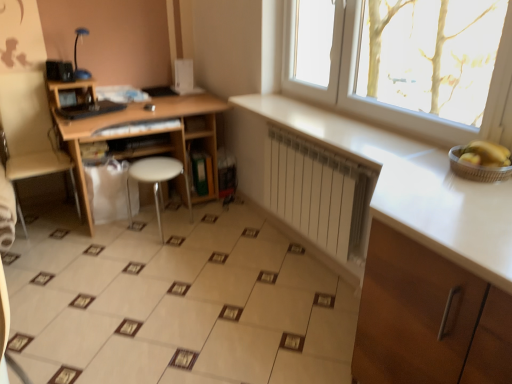
Question: From a real-world perspective, is white matte radiator at center under beige ceramic tile at center?

Choices:
 (A) no
 (B) yes

Answer: (A)

Question: Is white matte radiator at center directly adjacent to beige ceramic tile at center?

Choices:
 (A) yes
 (B) no

Answer: (B)

Question: Is the depth of white matte radiator at center greater than that of beige ceramic tile at center?

Choices:
 (A) no
 (B) yes

Answer: (B)

Question: Is white matte radiator at center wider than beige ceramic tile at center?

Choices:
 (A) yes
 (B) no

Answer: (B)

Question: From the image's perspective, would you say white matte radiator at center is positioned over beige ceramic tile at center?

Choices:
 (A) no
 (B) yes

Answer: (B)

Question: From a real-world perspective, is white wood cabinet at lower right above or below beige ceramic tile at center?

Choices:
 (A) below
 (B) above

Answer: (B)

Question: Is point (410, 322) closer or farther from the camera than point (204, 205)?

Choices:
 (A) closer
 (B) farther

Answer: (A)

Question: From the image's perspective, is white wood cabinet at lower right positioned above or below beige ceramic tile at center?

Choices:
 (A) below
 (B) above

Answer: (B)

Question: In terms of size, does white wood cabinet at lower right appear bigger or smaller than beige ceramic tile at center?

Choices:
 (A) small
 (B) big

Answer: (B)

Question: From a real-world perspective, relative to white matte radiator at center, is beige ceramic tile at center vertically above or below?

Choices:
 (A) below
 (B) above

Answer: (A)

Question: In the image, is beige ceramic tile at center positioned in front of or behind white matte radiator at center?

Choices:
 (A) behind
 (B) front

Answer: (B)

Question: Considering the positions of beige ceramic tile at center and white matte radiator at center in the image, is beige ceramic tile at center bigger or smaller than white matte radiator at center?

Choices:
 (A) big
 (B) small

Answer: (A)

Question: From the image's perspective, relative to white matte radiator at center, is beige ceramic tile at center above or below?

Choices:
 (A) below
 (B) above

Answer: (A)

Question: Looking at their shapes, would you say blue glossy lamp at upper left is wider or thinner than metallic silver basket at right?

Choices:
 (A) wide
 (B) thin

Answer: (A)

Question: From a real-world perspective, is blue glossy lamp at upper left above or below metallic silver basket at right?

Choices:
 (A) below
 (B) above

Answer: (B)